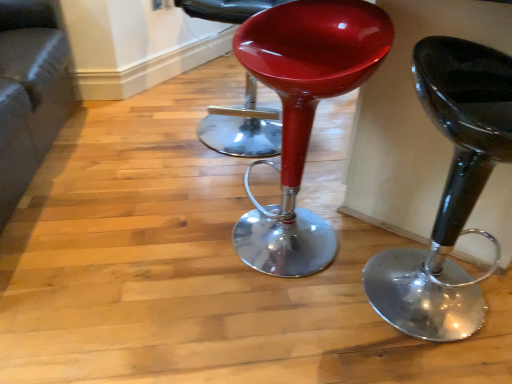
You are a GUI agent. You are given a task and a screenshot of the screen. Output one action in this format:
    pyautogui.click(x=<x>, y=<y>)
    Task: Click on the glossy plastic stool at center
    Image resolution: width=512 pixels, height=384 pixels.
    Given the screenshot: What is the action you would take?
    pyautogui.click(x=242, y=127)

In order to click on glossy plastic stool at center, the 1th stool in the right-to-left sequence in this screenshot , I will do `click(449, 191)`.

Which is in front, point (446, 304) or point (3, 18)?

The point (446, 304) is closer.

Which object is closer to the camera, glossy plastic stool at center, the 2th stool in the left-to-right sequence, or velvet grey couch at lower left?

glossy plastic stool at center, the 2th stool in the left-to-right sequence, is closer to the camera.

From the image's perspective, is glossy plastic stool at center, the 1th stool in the right-to-left sequence, positioned above or below velvet grey couch at lower left?

Clearly, from the image's perspective, glossy plastic stool at center, the 1th stool in the right-to-left sequence, is below velvet grey couch at lower left.

Is glossy plastic stool at center, which is counted as the 1th stool, starting from the left, completely or partially outside of glossy plastic stool at center, the 2th stool in the left-to-right sequence?

Indeed, glossy plastic stool at center, which is counted as the 1th stool, starting from the left, is completely outside glossy plastic stool at center, the 2th stool in the left-to-right sequence.

In the scene shown: Does glossy plastic stool at center, which is counted as the 1th stool, starting from the left, have a smaller size compared to glossy plastic stool at center, the 1th stool in the right-to-left sequence?

Yes, glossy plastic stool at center, which is counted as the 1th stool, starting from the left, is smaller than glossy plastic stool at center, the 1th stool in the right-to-left sequence.

Considering the relative sizes of glossy plastic stool at center, the 2th stool when ordered from right to left, and glossy plastic stool at center, the 1th stool in the right-to-left sequence, in the image provided, is glossy plastic stool at center, the 2th stool when ordered from right to left, wider than glossy plastic stool at center, the 1th stool in the right-to-left sequence,?

No, glossy plastic stool at center, the 2th stool when ordered from right to left, is not wider than glossy plastic stool at center, the 1th stool in the right-to-left sequence.

From the image's perspective, is glossy plastic stool at center, the 2th stool when ordered from right to left, under glossy plastic stool at center, the 1th stool in the right-to-left sequence?

No, from the image's perspective, glossy plastic stool at center, the 2th stool when ordered from right to left, is not beneath glossy plastic stool at center, the 1th stool in the right-to-left sequence.

Is glossy plastic stool at center, the 2th stool in the left-to-right sequence, next to glossy plastic stool at center and touching it?

They are not placed beside each other.

Is point (412, 249) farther from viewer compared to point (239, 148)?

No, (412, 249) is in front of (239, 148).

From the image's perspective, is glossy plastic stool at center, the 1th stool in the right-to-left sequence, located above or below glossy plastic stool at center?

Based on their image positions, glossy plastic stool at center, the 1th stool in the right-to-left sequence, is located beneath glossy plastic stool at center.

Is glossy plastic stool at center inside glossy plastic stool at center, the 2th stool in the left-to-right sequence?

No, glossy plastic stool at center, the 2th stool in the left-to-right sequence, does not contain glossy plastic stool at center.

Considering the relative sizes of glossy plastic stool at center, the 2th stool in the left-to-right sequence, and glossy plastic stool at center, which is counted as the 1th stool, starting from the left, in the image provided, is glossy plastic stool at center, the 2th stool in the left-to-right sequence, wider than glossy plastic stool at center, which is counted as the 1th stool, starting from the left,?

Yes, glossy plastic stool at center, the 2th stool in the left-to-right sequence, is wider than glossy plastic stool at center, which is counted as the 1th stool, starting from the left.

Considering the positions of objects glossy plastic stool at center, the 1th stool in the right-to-left sequence, and glossy plastic stool at center, which is counted as the 1th stool, starting from the left, in the image provided, who is more to the right, glossy plastic stool at center, the 1th stool in the right-to-left sequence, or glossy plastic stool at center, which is counted as the 1th stool, starting from the left,?

glossy plastic stool at center, the 1th stool in the right-to-left sequence, is more to the right.

At what (x,y) coordinates should I click in order to perform the action: click on stool that appears below the glossy plastic stool at center, the 2th stool when ordered from right to left (from a real-world perspective). Please return your answer as a coordinate pair (x, y). Looking at the image, I should click on (449, 191).

Is point (399, 293) farther from camera compared to point (331, 229)?

No, it is not.

Which object is wider, glossy plastic stool at center, which is counted as the 1th stool, starting from the left, or velvet grey couch at lower left?

velvet grey couch at lower left.

Are glossy plastic stool at center, which is counted as the 1th stool, starting from the left, and velvet grey couch at lower left beside each other?

No, glossy plastic stool at center, which is counted as the 1th stool, starting from the left, is not with velvet grey couch at lower left.

Identify the location of stool located behind the velvet grey couch at lower left. (303, 114).

Between point (330, 255) and point (4, 40), which one is positioned in front?

The point (330, 255) is closer.

Can you confirm if glossy plastic stool at center is positioned to the right of glossy plastic stool at center, which is counted as the 1th stool, starting from the left?

In fact, glossy plastic stool at center is to the left of glossy plastic stool at center, which is counted as the 1th stool, starting from the left.

Is glossy plastic stool at center not close to glossy plastic stool at center, the 2th stool when ordered from right to left?

No, glossy plastic stool at center is in close proximity to glossy plastic stool at center, the 2th stool when ordered from right to left.

Is glossy plastic stool at center situated inside glossy plastic stool at center, the 2th stool when ordered from right to left, or outside?

glossy plastic stool at center lies outside glossy plastic stool at center, the 2th stool when ordered from right to left.

Considering the positions of points (221, 9) and (261, 30), is point (221, 9) closer to camera compared to point (261, 30)?

No.

Considering the positions of objects velvet grey couch at lower left and glossy plastic stool at center, the 2th stool when ordered from right to left, in the image provided, who is more to the left, velvet grey couch at lower left or glossy plastic stool at center, the 2th stool when ordered from right to left,?

Positioned to the left is velvet grey couch at lower left.

Is velvet grey couch at lower left positioned beyond the bounds of glossy plastic stool at center, which is counted as the 1th stool, starting from the left?

Indeed, velvet grey couch at lower left is completely outside glossy plastic stool at center, which is counted as the 1th stool, starting from the left.

Considering the sizes of objects velvet grey couch at lower left and glossy plastic stool at center, the 2th stool when ordered from right to left, in the image provided, who is smaller, velvet grey couch at lower left or glossy plastic stool at center, the 2th stool when ordered from right to left,?

Smaller between the two is glossy plastic stool at center, the 2th stool when ordered from right to left.

Locate an element on the screen. This screenshot has width=512, height=384. couch that is behind the glossy plastic stool at center, the 2th stool in the left-to-right sequence is located at coordinates (29, 93).

The height and width of the screenshot is (384, 512). What are the coordinates of `stool in front of the glossy plastic stool at center, the 2th stool when ordered from right to left` in the screenshot? It's located at (449, 191).

Considering their positions, is velvet grey couch at lower left positioned closer to glossy plastic stool at center, the 2th stool when ordered from right to left, than glossy plastic stool at center, the 1th stool in the right-to-left sequence?

glossy plastic stool at center, the 1th stool in the right-to-left sequence, lies closer to glossy plastic stool at center, the 2th stool when ordered from right to left, than the other object.

Estimate the real-world distances between objects in this image. Which object is further from glossy plastic stool at center, the 2th stool when ordered from right to left, glossy plastic stool at center, the 2th stool in the left-to-right sequence, or glossy plastic stool at center?

glossy plastic stool at center.

Which object lies further to the anchor point velvet grey couch at lower left, glossy plastic stool at center, the 1th stool in the right-to-left sequence, or glossy plastic stool at center, the 2th stool when ordered from right to left?

glossy plastic stool at center, the 1th stool in the right-to-left sequence, lies further to velvet grey couch at lower left than the other object.

When comparing their distances from glossy plastic stool at center, does glossy plastic stool at center, the 2th stool in the left-to-right sequence, or velvet grey couch at lower left seem further?

Among the two, glossy plastic stool at center, the 2th stool in the left-to-right sequence, is located further to glossy plastic stool at center.

Which object lies nearer to the anchor point velvet grey couch at lower left, glossy plastic stool at center, the 2th stool in the left-to-right sequence, or glossy plastic stool at center?

glossy plastic stool at center.

Looking at the image, which one is located further to glossy plastic stool at center, glossy plastic stool at center, which is counted as the 1th stool, starting from the left, or velvet grey couch at lower left?

velvet grey couch at lower left is positioned further to the anchor glossy plastic stool at center.

Looking at the image, which one is located further to glossy plastic stool at center, which is counted as the 1th stool, starting from the left, glossy plastic stool at center or velvet grey couch at lower left?

velvet grey couch at lower left is further to glossy plastic stool at center, which is counted as the 1th stool, starting from the left.

Considering their positions, is velvet grey couch at lower left positioned further to glossy plastic stool at center than glossy plastic stool at center, the 1th stool in the right-to-left sequence?

Result: The object further to glossy plastic stool at center is glossy plastic stool at center, the 1th stool in the right-to-left sequence.

Find the location of a particular element. This screenshot has height=384, width=512. chair situated between velvet grey couch at lower left and glossy plastic stool at center, the 2th stool when ordered from right to left, from left to right is located at coordinates (242, 127).

You are a GUI agent. You are given a task and a screenshot of the screen. Output one action in this format:
    pyautogui.click(x=<x>, y=<y>)
    Task: Click on the stool between glossy plastic stool at center, the 2th stool in the left-to-right sequence, and glossy plastic stool at center, along the z-axis
    This screenshot has height=384, width=512.
    Given the screenshot: What is the action you would take?
    pyautogui.click(x=303, y=114)

The image size is (512, 384). Find the location of `stool between velvet grey couch at lower left and glossy plastic stool at center, the 1th stool in the right-to-left sequence`. stool between velvet grey couch at lower left and glossy plastic stool at center, the 1th stool in the right-to-left sequence is located at coordinates (303, 114).

I want to click on chair between velvet grey couch at lower left and glossy plastic stool at center, the 1th stool in the right-to-left sequence, so click(242, 127).